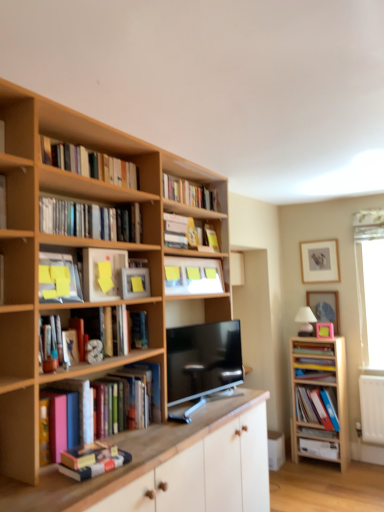
You are a GUI agent. You are given a task and a screenshot of the screen. Output one action in this format:
    pyautogui.click(x=<x>, y=<y>)
    Task: Click on the free space in front of wooden cabinet at right, which is counted as the second cabinetry, starting from the front
    This screenshot has height=512, width=384.
    Given the screenshot: What is the action you would take?
    pyautogui.click(x=346, y=475)